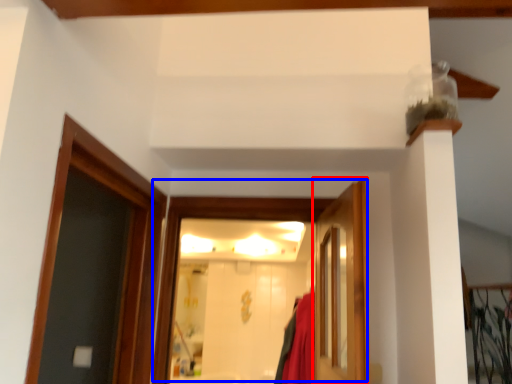
Question: Which object appears closest to the camera in this image, door (highlighted by a red box) or door (highlighted by a blue box)?

Choices:
 (A) door
 (B) door

Answer: (A)